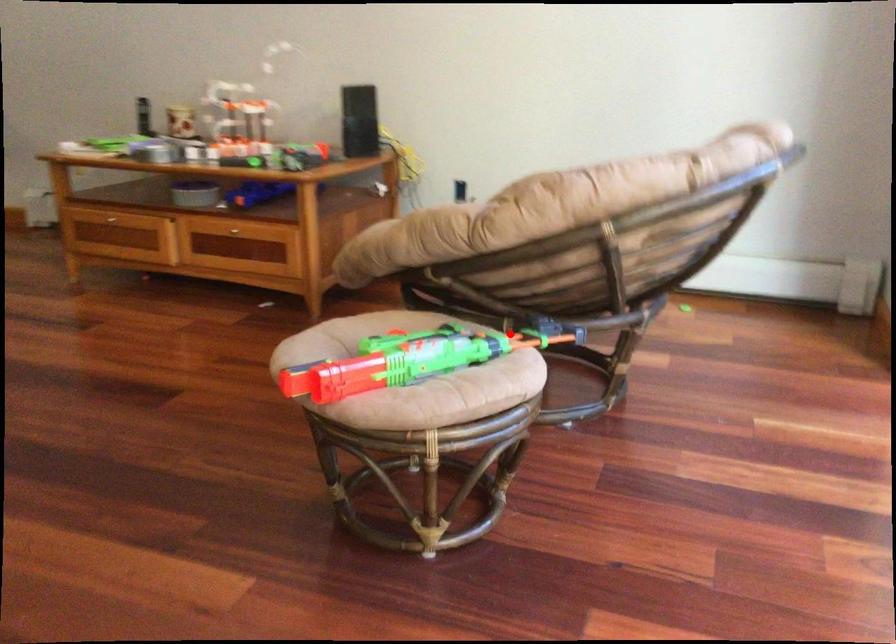
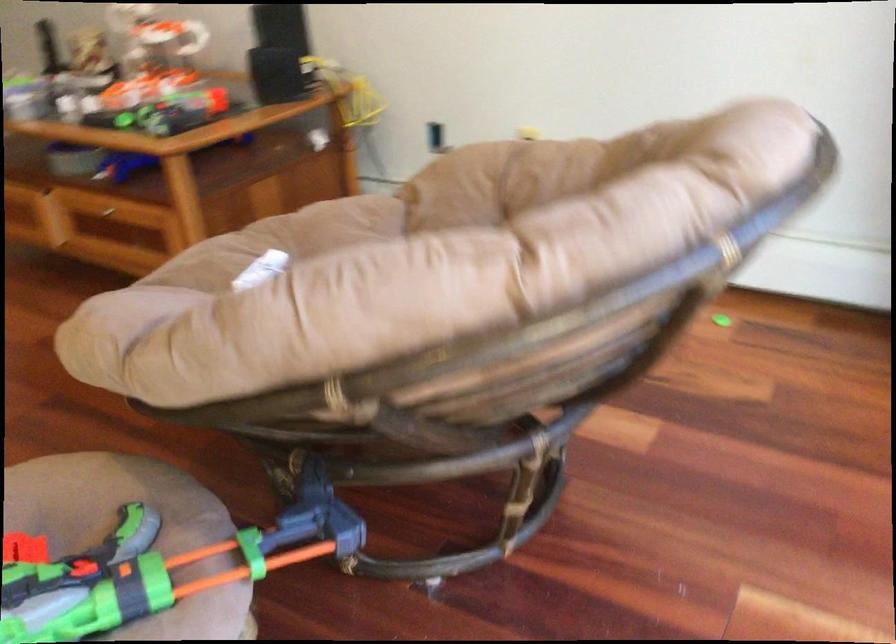
Where in the second image is the point corresponding to the highlighted location from the first image?

(159, 567)